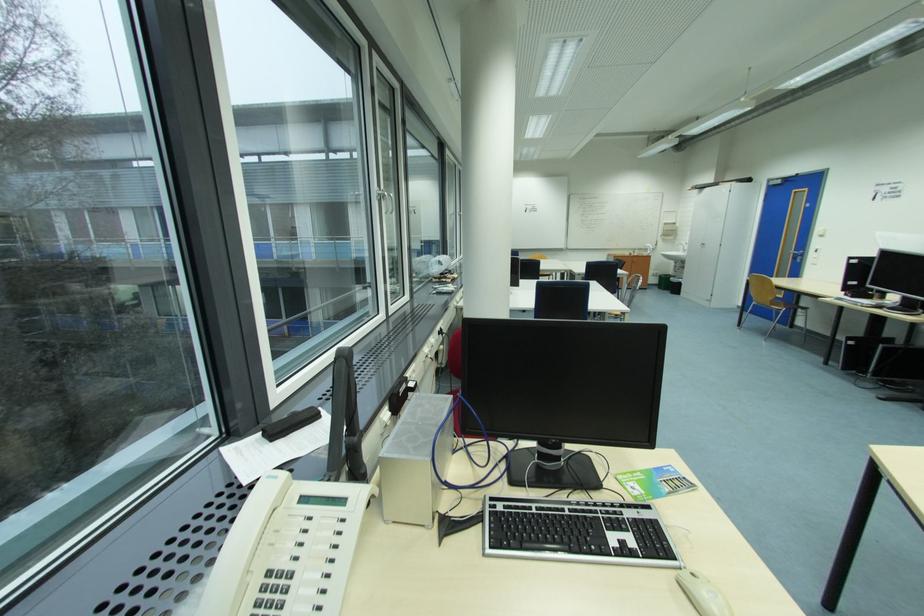
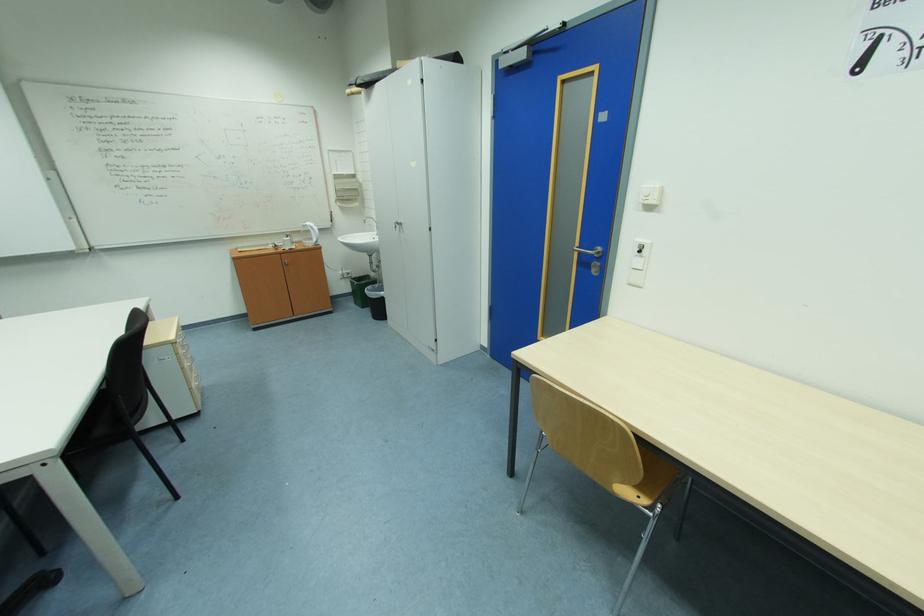
Find the pixel in the second image that matches (821,265) in the first image.

(638, 286)